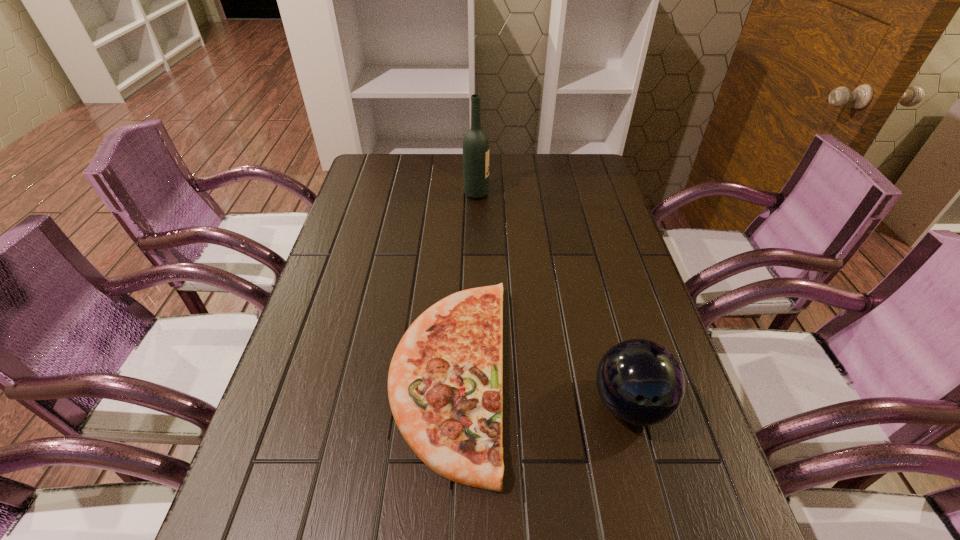
You are a GUI agent. You are given a task and a screenshot of the screen. Output one action in this format:
    pyautogui.click(x=<x>, y=<y>)
    Task: Click on the farthest object
    The width and height of the screenshot is (960, 540).
    Given the screenshot: What is the action you would take?
    pyautogui.click(x=475, y=143)

The image size is (960, 540). Find the location of `wine bottle`. wine bottle is located at coordinates (475, 143).

Locate an element on the screen. The image size is (960, 540). the rightmost object is located at coordinates (642, 383).

You are a GUI agent. You are given a task and a screenshot of the screen. Output one action in this format:
    pyautogui.click(x=<x>, y=<y>)
    Task: Click on the second tallest object
    The height and width of the screenshot is (540, 960).
    Given the screenshot: What is the action you would take?
    pyautogui.click(x=642, y=383)

The width and height of the screenshot is (960, 540). Identify the location of the shortest object. (445, 384).

I want to click on vacant space positioned on the labeled side of the farthest object, so click(504, 194).

Where is `vacant space located on the side of the bowling ball with the finger holes`? vacant space located on the side of the bowling ball with the finger holes is located at coordinates (649, 473).

Find the location of `free region located 0.080m on the left of the pizza`. free region located 0.080m on the left of the pizza is located at coordinates (353, 373).

The height and width of the screenshot is (540, 960). Find the location of `object that is at the far edge`. object that is at the far edge is located at coordinates (475, 143).

This screenshot has height=540, width=960. I want to click on object that is positioned at the right edge, so click(642, 383).